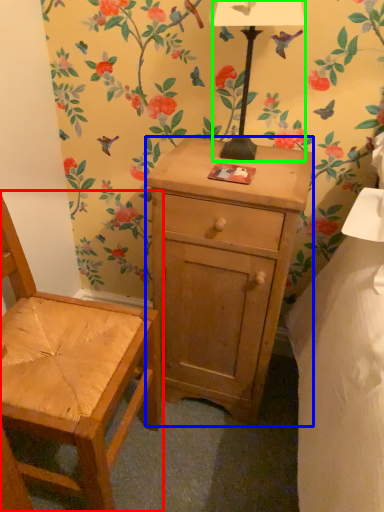
Question: Based on their relative distances, which object is farther from chair (highlighted by a red box)? Choose from desk (highlighted by a blue box) and lamp (highlighted by a green box).

Choices:
 (A) desk
 (B) lamp

Answer: (B)